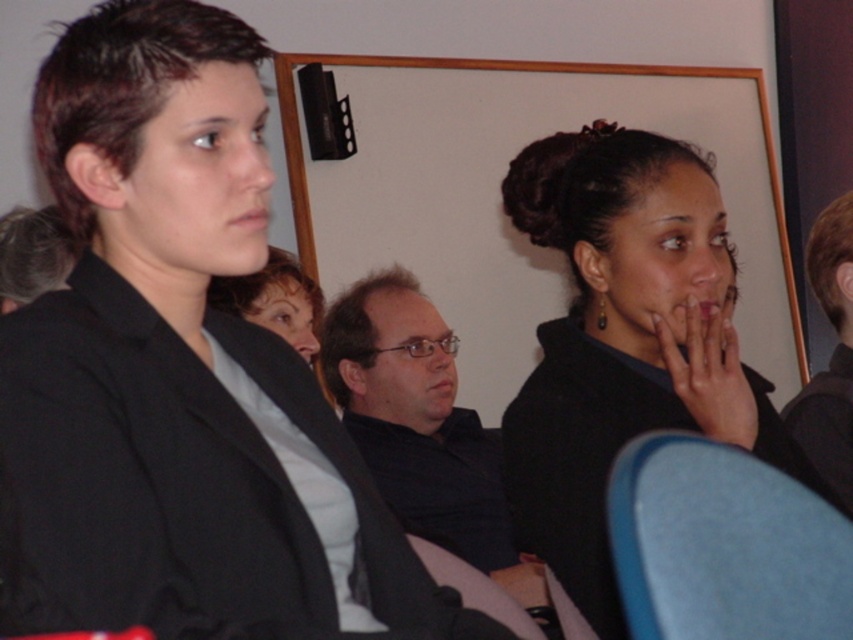
Question: Is blue fabric chair at lower right above dark blue shirt at center?

Choices:
 (A) yes
 (B) no

Answer: (A)

Question: Which point is closer to the camera?

Choices:
 (A) dark blue shirt at center
 (B) black matte blazer at left

Answer: (B)

Question: From the image, what is the correct spatial relationship of black matte hair at center in relation to blue fabric chair at lower right?

Choices:
 (A) left
 (B) right

Answer: (B)

Question: Can you confirm if blue fabric chair at lower right is bigger than dark brown hair at upper right?

Choices:
 (A) yes
 (B) no

Answer: (B)

Question: Which point appears farthest from the camera in this image?

Choices:
 (A) 718,330
 (B) 6,460
 (C) 547,198
 (D) 838,285

Answer: (D)

Question: Which point is farther from the camera taking this photo?

Choices:
 (A) (781, 593)
 (B) (729, 308)

Answer: (B)